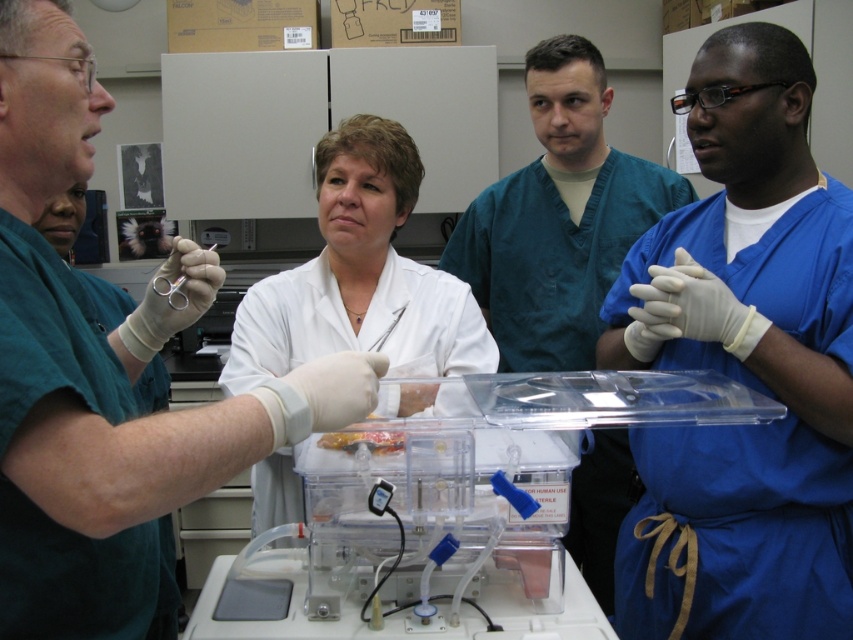
Does blue scrubs at right appear over transparent plastic container at center?

Correct, blue scrubs at right is located above transparent plastic container at center.

Is point (699, 552) positioned before point (492, 572)?

No, it is not.

Measure the distance between blue scrubs at right and camera.

blue scrubs at right and camera are 1.24 meters apart from each other.

This screenshot has width=853, height=640. I want to click on blue scrubs at right, so click(x=743, y=365).

Is transparent plastic container at center positioned in front of white lab coat at center?

Yes, it is in front of white lab coat at center.

Which of these two, transparent plastic container at center or white lab coat at center, stands taller?

white lab coat at center is taller.

Identify the location of transparent plastic container at center. (450, 508).

Does transparent plastic container at center appear on the right side of blue scrubs at center?

Incorrect, transparent plastic container at center is not on the right side of blue scrubs at center.

Is point (546, 531) behind point (590, 156)?

No, it is in front of (590, 156).

Which is in front, point (529, 456) or point (457, 259)?

Positioned in front is point (529, 456).

Identify the location of transparent plastic container at center. This screenshot has height=640, width=853. (450, 508).